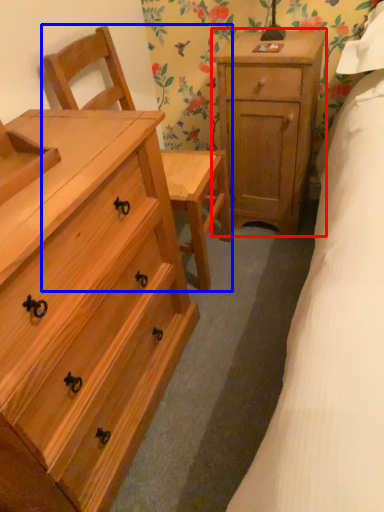
Question: Which object appears closest to the camera in this image, nightstand (highlighted by a red box) or armchair (highlighted by a blue box)?

Choices:
 (A) nightstand
 (B) armchair

Answer: (B)